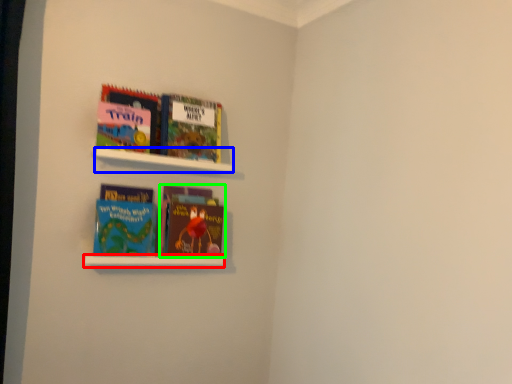
Question: Based on their relative distances, which object is farther from cabinet (highlighted by a red box)? Choose from cabinet (highlighted by a blue box) and book (highlighted by a green box).

Choices:
 (A) cabinet
 (B) book

Answer: (A)